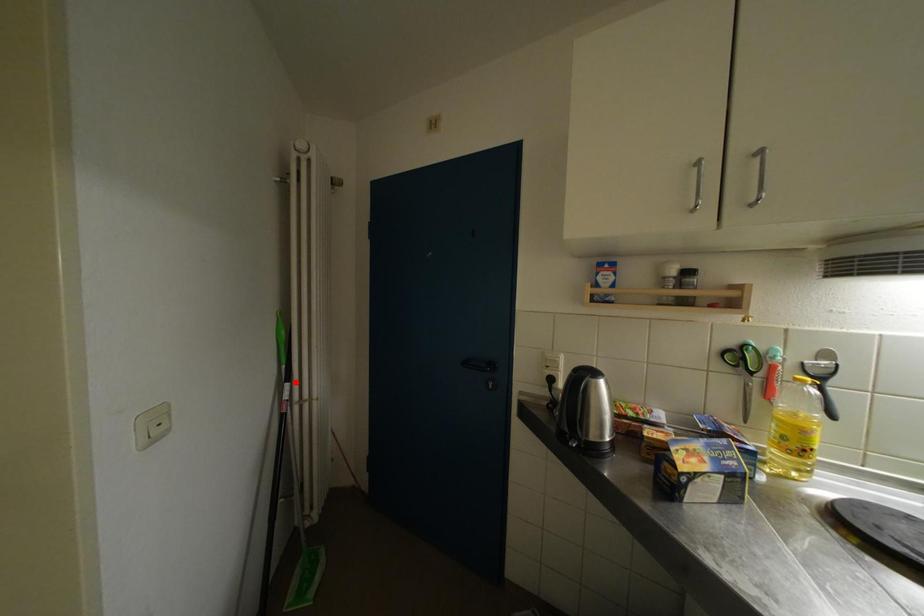
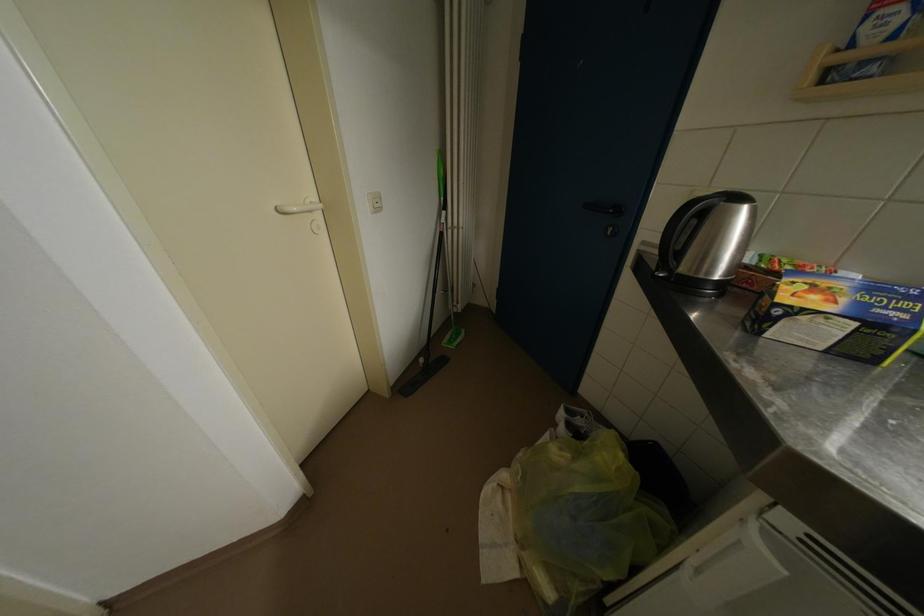
Find the pixel in the second image that matches the highlighted location in the first image.

(451, 211)